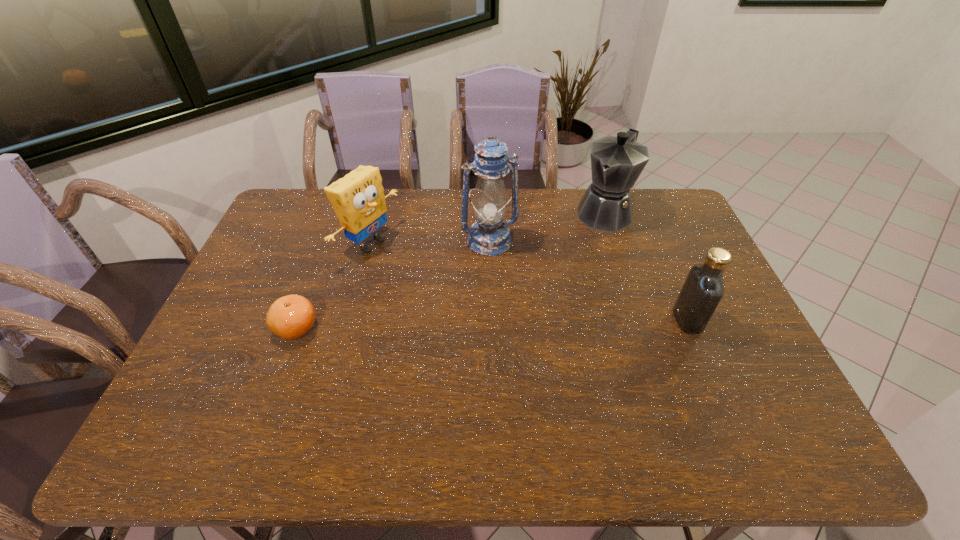
The height and width of the screenshot is (540, 960). I want to click on the shortest object, so click(289, 317).

Where is `vodka`? The width and height of the screenshot is (960, 540). vodka is located at coordinates (703, 288).

I want to click on sponge, so click(358, 199).

This screenshot has height=540, width=960. Identify the location of the third object from right to left. (x=489, y=236).

Image resolution: width=960 pixels, height=540 pixels. I want to click on lantern, so click(489, 236).

The height and width of the screenshot is (540, 960). What are the coordinates of `the second tallest object` in the screenshot? It's located at (616, 162).

Identify the location of the fourth object from left to right. (616, 162).

Image resolution: width=960 pixels, height=540 pixels. Find the location of `vacant area located 0.160m on the left of the shortest object`. vacant area located 0.160m on the left of the shortest object is located at coordinates (216, 328).

Identify the location of free space located 0.080m on the front-facing side of the vodka. The image size is (960, 540). (729, 320).

Find the location of a particular element. The image size is (960, 540). vacant area situated on the face of the sponge is located at coordinates (443, 285).